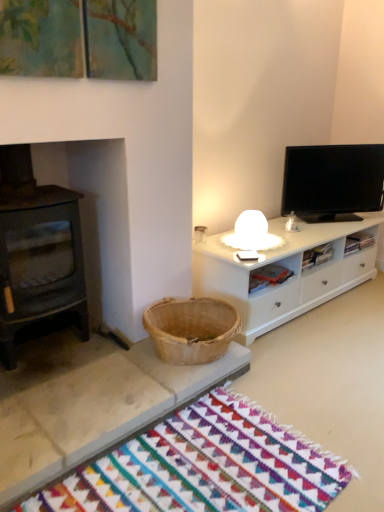
Find the location of a particular element. The image size is (384, 512). free space above multicolored woven mat at lower center (from a real-world perspective) is located at coordinates (203, 464).